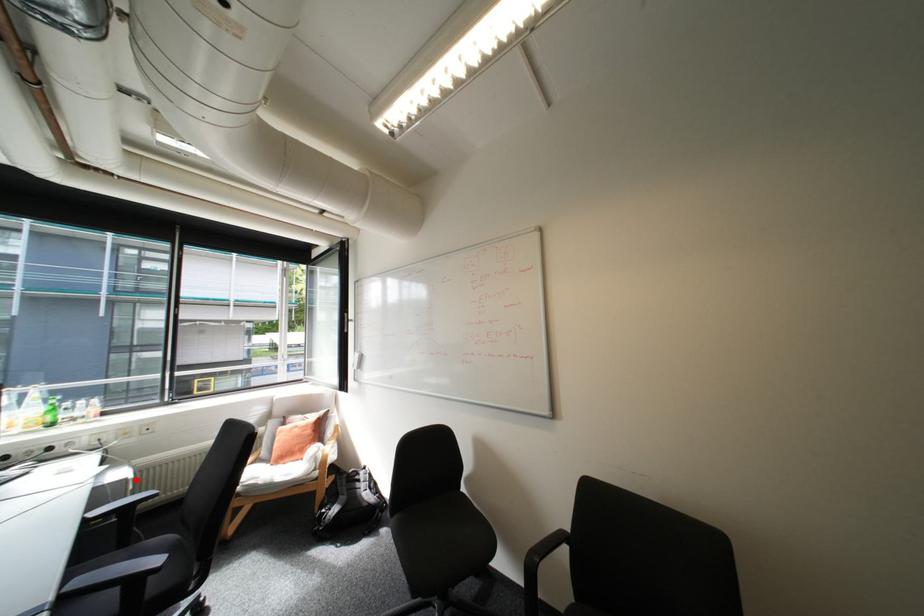
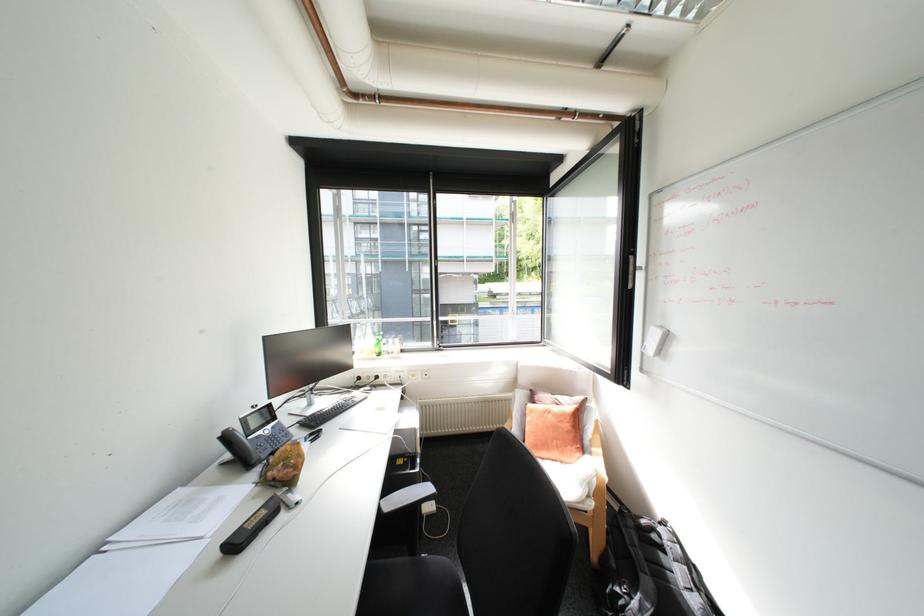
The point at the highlighted location is marked in the first image. Where is the corresponding point in the second image?

(424, 429)